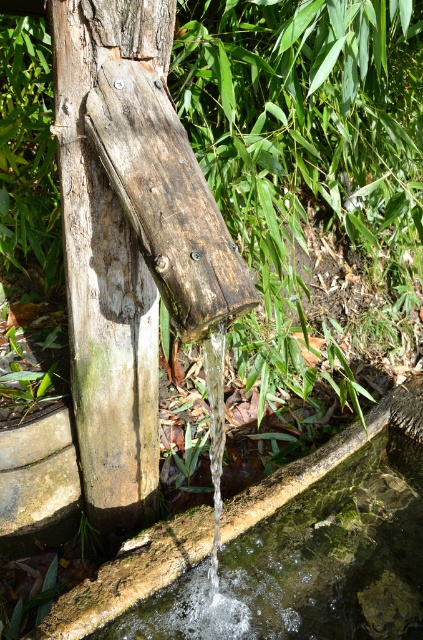
Who is positioned more to the right, weathered wood at center or clear water at lower center?

Positioned to the right is clear water at lower center.

The height and width of the screenshot is (640, 423). What do you see at coordinates (107, 268) in the screenshot? I see `weathered wood at center` at bounding box center [107, 268].

I want to click on weathered wood at center, so click(107, 268).

Identify the location of weathered wood at center. Image resolution: width=423 pixels, height=640 pixels. (107, 268).